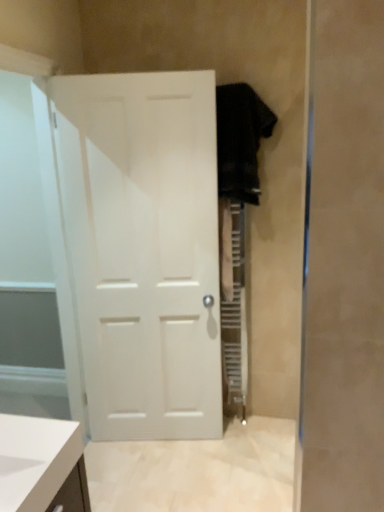
Question: Considering the positions of point tap(21, 350) and point tap(253, 157), is point tap(21, 350) closer or farther from the camera than point tap(253, 157)?

Choices:
 (A) closer
 (B) farther

Answer: (B)

Question: From the image's perspective, relative to black fabric robe at right, is transparent glass door at left above or below?

Choices:
 (A) above
 (B) below

Answer: (B)

Question: Considering the real-world distances, which object is closest to the black fabric robe at right?

Choices:
 (A) white matte door at center
 (B) transparent glass door at left

Answer: (A)

Question: Which of these objects is positioned closest to the white matte door at center?

Choices:
 (A) transparent glass door at left
 (B) black fabric robe at right

Answer: (A)